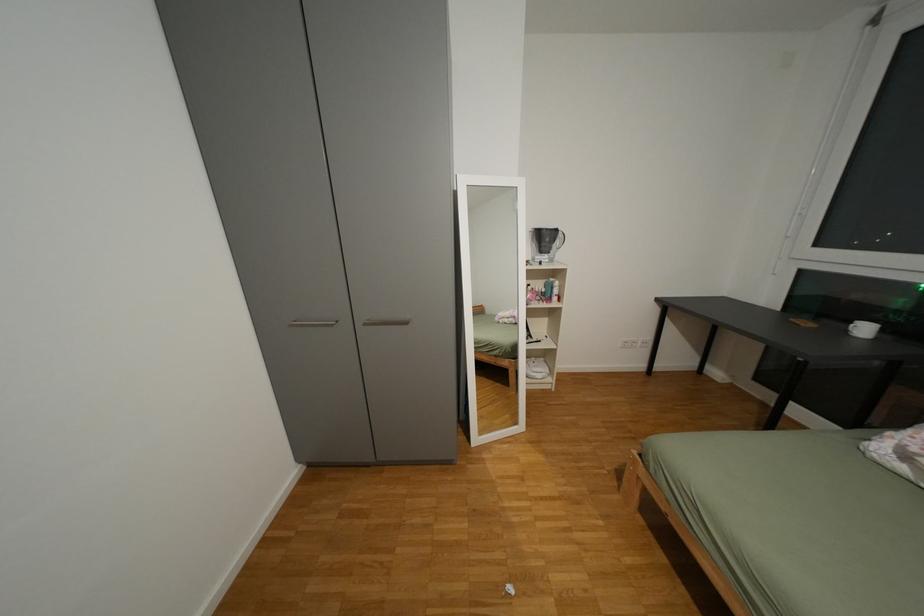
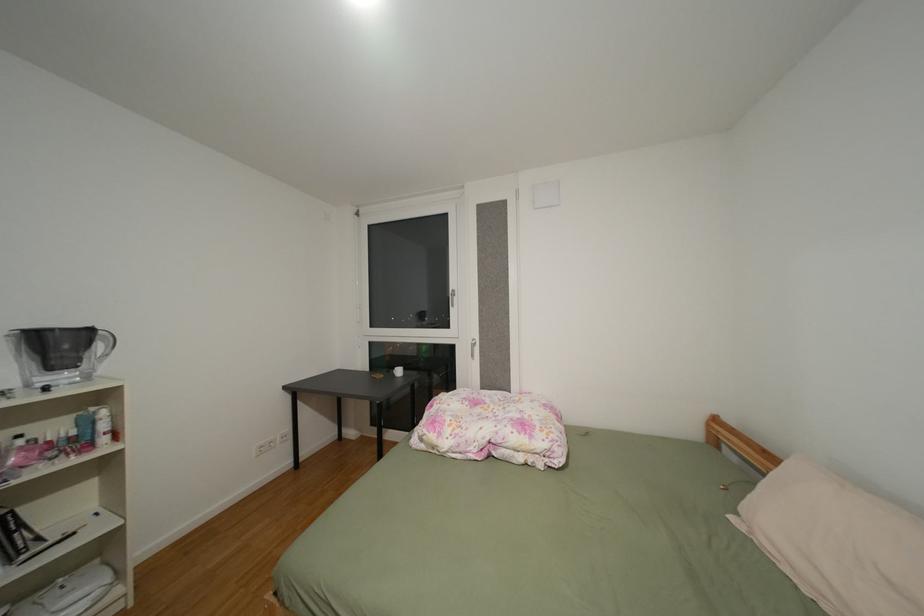
Question: How did the camera likely rotate?

Choices:
 (A) Left
 (B) Right
 (C) Up
 (D) Down

Answer: (B)